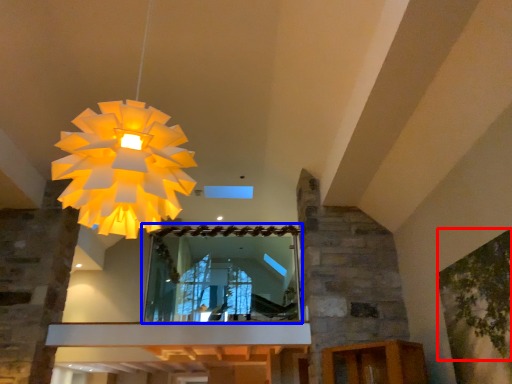
Question: Which of the following is the closest to the observer, tree (highlighted by a red box) or mirror (highlighted by a blue box)?

Choices:
 (A) tree
 (B) mirror

Answer: (A)